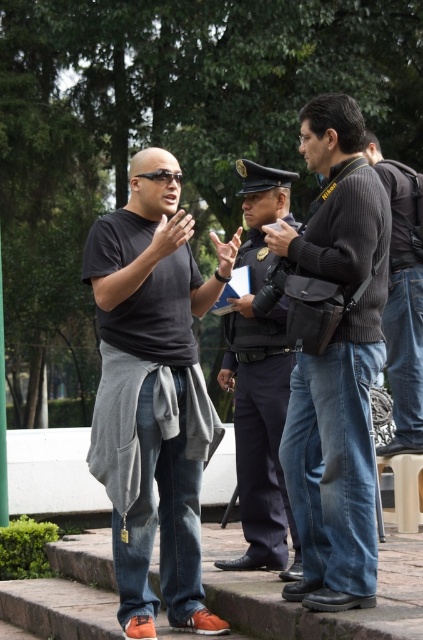
Question: Is the position of dark blue uniform at center more distant than that of ribbed sweater at center?

Choices:
 (A) no
 (B) yes

Answer: (A)

Question: Among these objects, which one is farthest from the camera?

Choices:
 (A) ribbed sweater at center
 (B) matte black shirt at center
 (C) dark gray sweater at center
 (D) dark blue uniform at center

Answer: (A)

Question: Does dark blue uniform at center come behind ribbed sweater at center?

Choices:
 (A) no
 (B) yes

Answer: (A)

Question: Which of the following is the farthest from the observer?

Choices:
 (A) (242, 243)
 (B) (318, 392)

Answer: (A)

Question: Estimate the real-world distances between objects in this image. Which object is closer to the dark gray sweater at center?

Choices:
 (A) ribbed sweater at center
 (B) matte black shirt at center
 (C) dark blue uniform at center

Answer: (B)

Question: Does dark gray sweater at center have a greater width compared to matte black shirt at center?

Choices:
 (A) no
 (B) yes

Answer: (A)